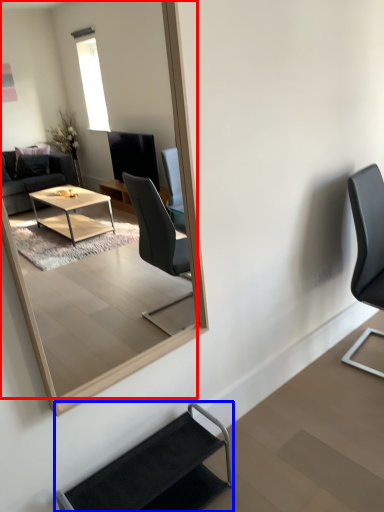
Question: Which of the following is the closest to the observer, mirror (highlighted by a red box) or chair (highlighted by a blue box)?

Choices:
 (A) mirror
 (B) chair

Answer: (A)